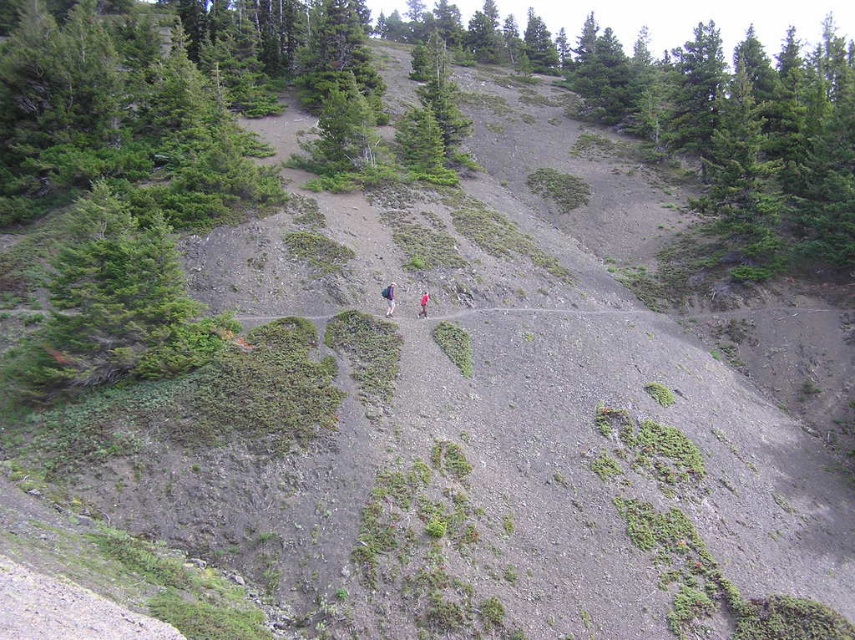
Question: From the image, what is the correct spatial relationship of purple fabric backpack at center in relation to pink fabric at center?

Choices:
 (A) left
 (B) right

Answer: (A)

Question: Which point appears closest to the camera in this image?

Choices:
 (A) (423, 298)
 (B) (386, 301)

Answer: (A)

Question: Does green textured shrub at left have a greater width compared to pink fabric at center?

Choices:
 (A) yes
 (B) no

Answer: (A)

Question: Among these points, which one is nearest to the camera?

Choices:
 (A) (36, 365)
 (B) (392, 310)
 (C) (423, 300)

Answer: (A)

Question: Where is green textured shrub at left located in relation to purple fabric backpack at center in the image?

Choices:
 (A) right
 (B) left

Answer: (B)

Question: Which object is farther from the camera taking this photo?

Choices:
 (A) green textured shrub at left
 (B) purple fabric backpack at center

Answer: (B)